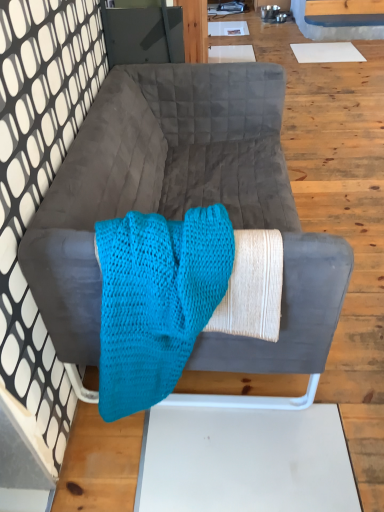
Question: Is velvet gray couch at center placed right next to turquoise knitted blanket at center?

Choices:
 (A) yes
 (B) no

Answer: (B)

Question: Considering the relative sizes of velvet gray couch at center and turquoise knitted blanket at center in the image provided, is velvet gray couch at center taller than turquoise knitted blanket at center?

Choices:
 (A) no
 (B) yes

Answer: (B)

Question: Can you confirm if velvet gray couch at center is thinner than turquoise knitted blanket at center?

Choices:
 (A) no
 (B) yes

Answer: (A)

Question: Would you say turquoise knitted blanket at center is part of velvet gray couch at center's contents?

Choices:
 (A) yes
 (B) no

Answer: (A)

Question: From a real-world perspective, is velvet gray couch at center positioned under turquoise knitted blanket at center based on gravity?

Choices:
 (A) no
 (B) yes

Answer: (B)

Question: Is velvet gray couch at center completely or partially outside of turquoise knitted blanket at center?

Choices:
 (A) no
 (B) yes

Answer: (B)

Question: Does turquoise knitted blanket at center have a lesser width compared to velvet gray couch at center?

Choices:
 (A) no
 (B) yes

Answer: (B)

Question: Is turquoise knitted blanket at center facing towards velvet gray couch at center?

Choices:
 (A) yes
 (B) no

Answer: (A)

Question: Is turquoise knitted blanket at center far from velvet gray couch at center?

Choices:
 (A) yes
 (B) no

Answer: (B)

Question: Can you see turquoise knitted blanket at center touching velvet gray couch at center?

Choices:
 (A) no
 (B) yes

Answer: (A)

Question: Can you confirm if turquoise knitted blanket at center is bigger than velvet gray couch at center?

Choices:
 (A) no
 (B) yes

Answer: (A)

Question: Can we say turquoise knitted blanket at center lies outside velvet gray couch at center?

Choices:
 (A) no
 (B) yes

Answer: (A)

Question: Considering the positions of point (89, 230) and point (115, 344), is point (89, 230) closer or farther from the camera than point (115, 344)?

Choices:
 (A) closer
 (B) farther

Answer: (A)